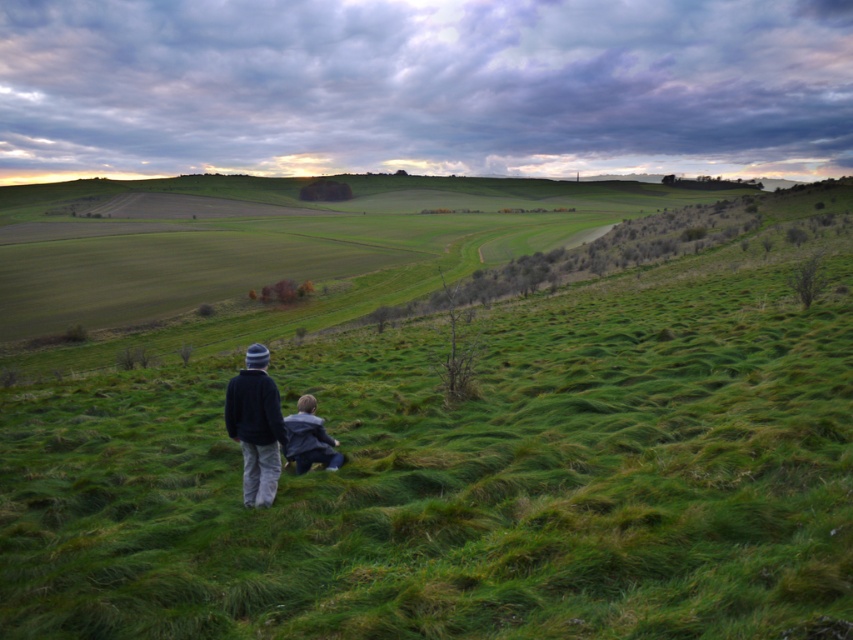
You are standing on the grassy hillside and want to give a gift to the person wearing the dark blue sweater at center. The gift is too large to carry while walking, so you decide to place it on the ground between the two people. Which direction should you place the gift relative to the blue denim jacket at lower center?

The dark blue sweater at center is smaller in size compared to the blue denim jacket at lower center. Since the gift needs to be placed between them, you should position it closer to the blue denim jacket at lower center, as the smaller sweater is likely worn by a child or someone needing the gift to be near the larger jacket.

Based on the photo, you are standing at the center of the image and want to walk towards the green grassy hillside at center. Which direction should you go?

The green grassy hillside at center is already at the center of the image, so you are already facing it. You can walk straight ahead.